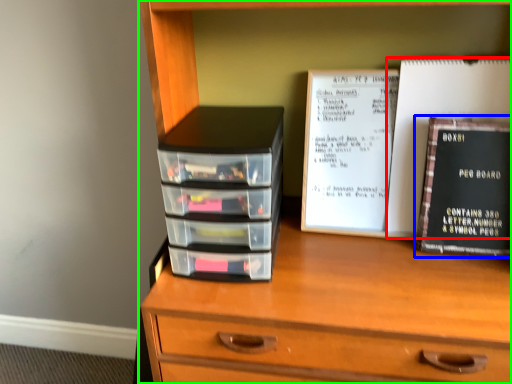
Question: Which object is the farthest from paperback book (highlighted by a red box)? Choose among these: book (highlighted by a blue box) or chest of drawers (highlighted by a green box).

Choices:
 (A) book
 (B) chest of drawers

Answer: (B)